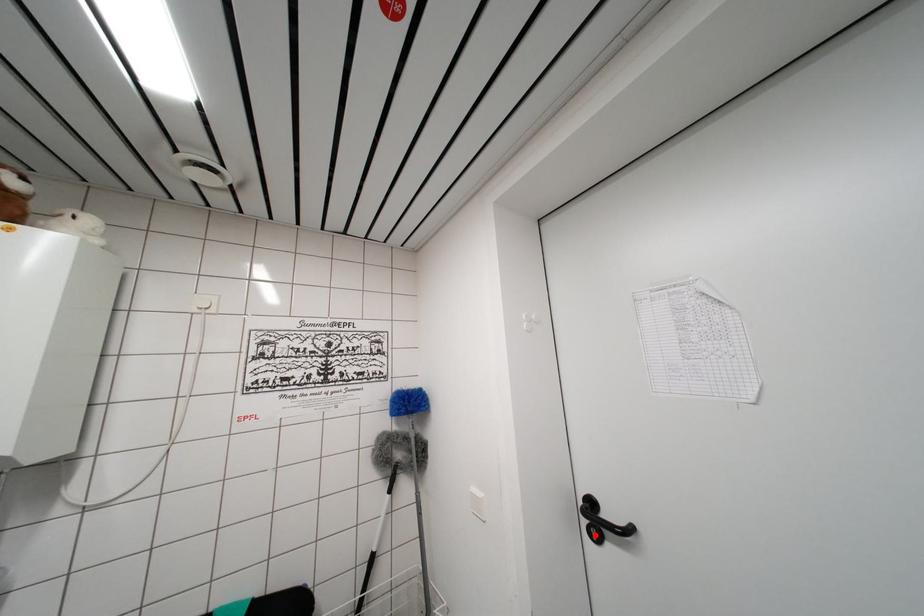
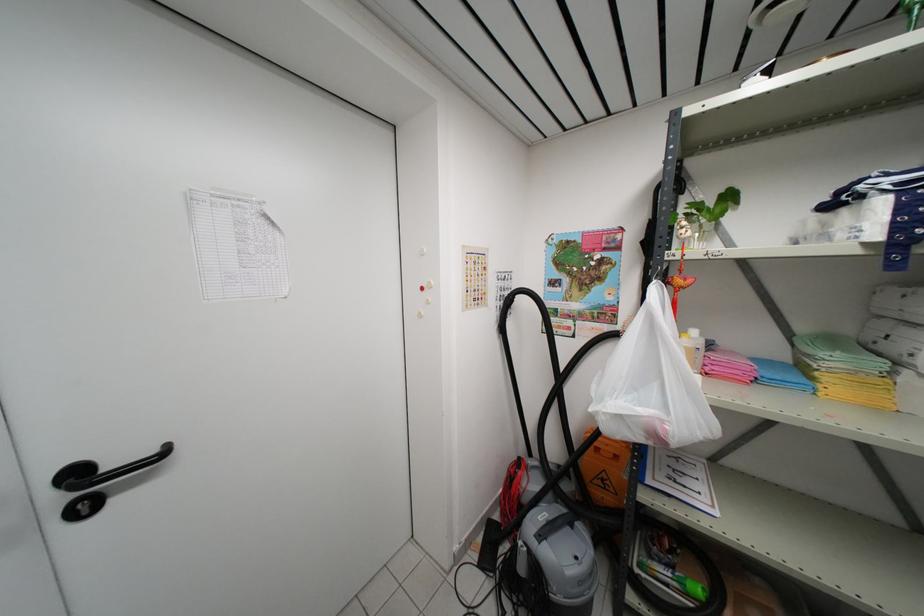
Question: I am providing you with two images of the same scene from different viewpoints. In image1, a red point is highlighted. Considering the same 3D point in image2, which of the following is correct?

Choices:
 (A) It is closer
 (B) It is farther

Answer: (A)